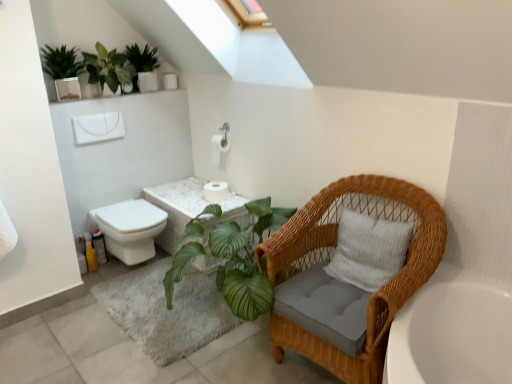
The height and width of the screenshot is (384, 512). What are the coordinates of `green leafy plant at upper left, marked as the 2th houseplant in a right-to-left arrangement` in the screenshot? It's located at (106, 69).

Describe the element at coordinates (177, 207) in the screenshot. I see `white wicker vanity at center` at that location.

This screenshot has height=384, width=512. In order to click on green matte plant at upper left, which ranks as the 3th houseplant in right-to-left order in this screenshot , I will do `click(61, 62)`.

What do you see at coordinates (336, 234) in the screenshot? I see `woven wicker chair at right` at bounding box center [336, 234].

What are the coordinates of `white matte toilet paper at center, arranged as the 1th toilet paper when ordered from the bottom` in the screenshot? It's located at (216, 191).

What is the approximate height of white glossy toilet at lower left?

white glossy toilet at lower left is 17.19 inches tall.

Where is `green leafy plant at upper left, placed as the second houseplant when sorted from left to right`? Image resolution: width=512 pixels, height=384 pixels. green leafy plant at upper left, placed as the second houseplant when sorted from left to right is located at coordinates (106, 69).

Is green matte plant at upper left, which ranks as the 1th houseplant in left-to-right order, outside of white wicker vanity at center?

That's correct, green matte plant at upper left, which ranks as the 1th houseplant in left-to-right order, is outside of white wicker vanity at center.

Does green matte plant at upper left, which ranks as the 1th houseplant in left-to-right order, turn towards white wicker vanity at center?

No.

At what (x,y) coordinates should I click in order to perform the action: click on the 1st houseplant positioned above the white wicker vanity at center (from the image's perspective). Please return your answer as a coordinate pair (x, y). The image size is (512, 384). Looking at the image, I should click on (61, 62).

Based on the photo, who is more distant, green matte plant at upper left, which ranks as the 3th houseplant in right-to-left order, or white wicker vanity at center?

white wicker vanity at center is more distant.

Considering the positions of points (132, 52) and (216, 142), is point (132, 52) farther from camera compared to point (216, 142)?

No.

Measure the distance between green leafy plant at upper center, which is counted as the first houseplant, starting from the right, and white matte toilet paper at center, the 1th toilet paper positioned from the top.

The distance of green leafy plant at upper center, which is counted as the first houseplant, starting from the right, from white matte toilet paper at center, the 1th toilet paper positioned from the top, is 29.55 inches.

From a real-world perspective, between green leafy plant at upper center, which is counted as the first houseplant, starting from the right, and white matte toilet paper at center, which is counted as the 2th toilet paper, starting from the bottom, who is vertically higher?

From a 3D spatial view, green leafy plant at upper center, which is counted as the first houseplant, starting from the right, is above.

From their relative heights in the image, would you say green leafy plant at upper center, marked as the third houseplant in a left-to-right arrangement, is taller or shorter than white matte toilet paper at center, the 1th toilet paper positioned from the top?

Clearly, green leafy plant at upper center, marked as the third houseplant in a left-to-right arrangement, is taller compared to white matte toilet paper at center, the 1th toilet paper positioned from the top.

Can you confirm if green matte plant at upper left, which ranks as the 1th houseplant in left-to-right order, is bigger than white matte toilet paper at center, which is counted as the 2th toilet paper, starting from the bottom?

Yes.

Looking at this image, considering the sizes of objects green matte plant at upper left, which ranks as the 1th houseplant in left-to-right order, and white matte toilet paper at center, the 1th toilet paper positioned from the top, in the image provided, who is taller, green matte plant at upper left, which ranks as the 1th houseplant in left-to-right order, or white matte toilet paper at center, the 1th toilet paper positioned from the top,?

green matte plant at upper left, which ranks as the 1th houseplant in left-to-right order, is taller.

Is green matte plant at upper left, which ranks as the 1th houseplant in left-to-right order, far away from white matte toilet paper at center, which is counted as the 2th toilet paper, starting from the bottom?

Yes, green matte plant at upper left, which ranks as the 1th houseplant in left-to-right order, is far from white matte toilet paper at center, which is counted as the 2th toilet paper, starting from the bottom.

Is green matte plant at upper left, which ranks as the 3th houseplant in right-to-left order, oriented towards white matte toilet paper at center, which is counted as the 2th toilet paper, starting from the bottom?

No, green matte plant at upper left, which ranks as the 3th houseplant in right-to-left order, is not facing towards white matte toilet paper at center, which is counted as the 2th toilet paper, starting from the bottom.

Is woven wicker chair at right at the left side of white matte toilet paper at center, arranged as the 1th toilet paper when ordered from the bottom?

In fact, woven wicker chair at right is to the right of white matte toilet paper at center, arranged as the 1th toilet paper when ordered from the bottom.

Is point (266, 240) farther from camera compared to point (220, 195)?

That is False.

From a real-world perspective, which is physically below, woven wicker chair at right or white matte toilet paper at center, arranged as the 1th toilet paper when ordered from the bottom?

In real-world perspective, woven wicker chair at right is lower.

Locate an element on the screen. The width and height of the screenshot is (512, 384). toilet paper that is the 2nd one when counting backward from the woven wicker chair at right is located at coordinates (216, 191).

Measure the distance from green matte plant at upper left, which ranks as the 3th houseplant in right-to-left order, to white matte toilet paper at center, placed as the second toilet paper when sorted from top to bottom.

green matte plant at upper left, which ranks as the 3th houseplant in right-to-left order, and white matte toilet paper at center, placed as the second toilet paper when sorted from top to bottom, are 4.04 feet apart.

Is green matte plant at upper left, which ranks as the 1th houseplant in left-to-right order, taller or shorter than white matte toilet paper at center, placed as the second toilet paper when sorted from top to bottom?

Clearly, green matte plant at upper left, which ranks as the 1th houseplant in left-to-right order, is taller compared to white matte toilet paper at center, placed as the second toilet paper when sorted from top to bottom.

At what (x,y) coordinates should I click in order to perform the action: click on houseplant that is the 3rd one when counting forward from the white matte toilet paper at center, arranged as the 1th toilet paper when ordered from the bottom. Please return your answer as a coordinate pair (x, y). Looking at the image, I should click on (61, 62).

Would you say green matte plant at upper left, which ranks as the 1th houseplant in left-to-right order, is inside or outside white matte toilet paper at center, arranged as the 1th toilet paper when ordered from the bottom?

green matte plant at upper left, which ranks as the 1th houseplant in left-to-right order, is spatially situated outside white matte toilet paper at center, arranged as the 1th toilet paper when ordered from the bottom.

Find the location of a particular element. The image size is (512, 384). the 2nd houseplant positioned above the woven wicker chair at right (from the image's perspective) is located at coordinates (106, 69).

Is green leafy plant at upper left, marked as the 2th houseplant in a right-to-left arrangement, positioned beyond the bounds of woven wicker chair at right?

Absolutely, green leafy plant at upper left, marked as the 2th houseplant in a right-to-left arrangement, is external to woven wicker chair at right.

Is green leafy plant at upper left, marked as the 2th houseplant in a right-to-left arrangement, bigger or smaller than woven wicker chair at right?

In the image, green leafy plant at upper left, marked as the 2th houseplant in a right-to-left arrangement, appears to be smaller than woven wicker chair at right.

From the image's perspective, who appears lower, white wicker vanity at center or green matte plant at upper left, which ranks as the 3th houseplant in right-to-left order?

From the image's view, white wicker vanity at center is below.

Between white wicker vanity at center and green matte plant at upper left, which ranks as the 3th houseplant in right-to-left order, which one has smaller size?

green matte plant at upper left, which ranks as the 3th houseplant in right-to-left order, is smaller.

Considering the positions of objects white wicker vanity at center and green matte plant at upper left, which ranks as the 1th houseplant in left-to-right order, in the image provided, who is more to the left, white wicker vanity at center or green matte plant at upper left, which ranks as the 1th houseplant in left-to-right order,?

Positioned to the left is green matte plant at upper left, which ranks as the 1th houseplant in left-to-right order.

Image resolution: width=512 pixels, height=384 pixels. Find the location of `the 2nd houseplant in front when counting from the white wicker vanity at center`. the 2nd houseplant in front when counting from the white wicker vanity at center is located at coordinates (61, 62).

I want to click on vanity below the green matte plant at upper left, which ranks as the 3th houseplant in right-to-left order (from the image's perspective), so click(177, 207).

Identify the location of toilet paper that is the 1st one below the green leafy plant at upper center, which is counted as the first houseplant, starting from the right (from a real-world perspective). The width and height of the screenshot is (512, 384). (219, 146).

Which object lies further to the anchor point woven wicker chair at right, green leafy plant at upper center, which is counted as the first houseplant, starting from the right, or white matte toilet paper at center, which is counted as the 2th toilet paper, starting from the bottom?

green leafy plant at upper center, which is counted as the first houseplant, starting from the right.

Which object lies nearer to the anchor point white glossy toilet at lower left, white matte toilet paper at center, the 1th toilet paper positioned from the top, or white matte toilet paper at center, placed as the second toilet paper when sorted from top to bottom?

Among the two, white matte toilet paper at center, placed as the second toilet paper when sorted from top to bottom, is located nearer to white glossy toilet at lower left.

Which object lies nearer to the anchor point white glossy toilet at lower left, green leafy plant at upper center, which is counted as the first houseplant, starting from the right, or white matte toilet paper at center, the 1th toilet paper positioned from the top?

white matte toilet paper at center, the 1th toilet paper positioned from the top, lies closer to white glossy toilet at lower left than the other object.

Which object lies nearer to the anchor point green leafy plant at upper center, which is counted as the first houseplant, starting from the right, woven wicker chair at right or green matte plant at upper left, which ranks as the 3th houseplant in right-to-left order?

Among the two, green matte plant at upper left, which ranks as the 3th houseplant in right-to-left order, is located nearer to green leafy plant at upper center, which is counted as the first houseplant, starting from the right.

Considering their positions, is woven wicker chair at right positioned further to green leafy plant at upper center, marked as the third houseplant in a left-to-right arrangement, than white wicker vanity at center?

woven wicker chair at right lies further to green leafy plant at upper center, marked as the third houseplant in a left-to-right arrangement, than the other object.

Estimate the real-world distances between objects in this image. Which object is closer to woven wicker chair at right, white glossy toilet at lower left or green leafy plant at upper left, marked as the 2th houseplant in a right-to-left arrangement?

Among the two, white glossy toilet at lower left is located nearer to woven wicker chair at right.

Considering their positions, is white matte toilet paper at center, which is counted as the 2th toilet paper, starting from the bottom, positioned closer to white glossy toilet at lower left than green matte plant at upper left, which ranks as the 3th houseplant in right-to-left order?

white matte toilet paper at center, which is counted as the 2th toilet paper, starting from the bottom, is positioned closer to the anchor white glossy toilet at lower left.

Considering their positions, is green leafy plant at upper left, marked as the 2th houseplant in a right-to-left arrangement, positioned further to white glossy toilet at lower left than green leafy plant at upper center, marked as the third houseplant in a left-to-right arrangement?

green leafy plant at upper center, marked as the third houseplant in a left-to-right arrangement, lies further to white glossy toilet at lower left than the other object.

I want to click on toilet between woven wicker chair at right and white wicker vanity at center in the front-back direction, so click(130, 229).

Find the location of `toilet between green matte plant at upper left, which ranks as the 3th houseplant in right-to-left order, and woven wicker chair at right`. toilet between green matte plant at upper left, which ranks as the 3th houseplant in right-to-left order, and woven wicker chair at right is located at coordinates (130, 229).

This screenshot has height=384, width=512. I want to click on vanity between green matte plant at upper left, which ranks as the 1th houseplant in left-to-right order, and white glossy toilet at lower left from top to bottom, so click(177, 207).

Where is `vanity between white glossy toilet at lower left and white matte toilet paper at center, arranged as the 1th toilet paper when ordered from the bottom`? vanity between white glossy toilet at lower left and white matte toilet paper at center, arranged as the 1th toilet paper when ordered from the bottom is located at coordinates (177, 207).